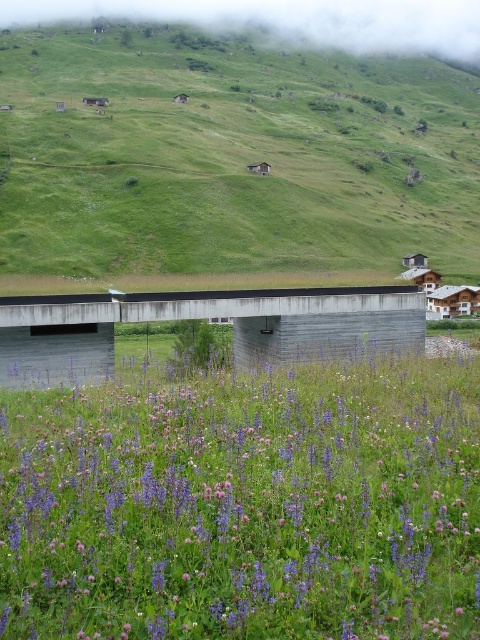
You are standing at the camera position and want to pick the purple matte flower at center. Is it within your reach without moving your feet?

The purple matte flower at center is 5.63 meters away from the camera, so it is too far to reach without moving your feet.

You are standing on the modern concrete bridge in the image and notice two points marked on the bridge surface. The first point is at coordinates point (20, 605) and the second is at point (112, 97). If you were to walk from the first point to the second point, would you be moving towards the bridge entrance or away from it?

Since point (20, 605) is in front of point (112, 97), walking from the first point to the second would mean moving away from the bridge entrance towards the opposite end.

You are standing at the point marked by the coordinates point (230, 156) in the image. What is the name of the object you are currently standing on?

The point (230, 156) corresponds to the green grassy hillside at upper center.